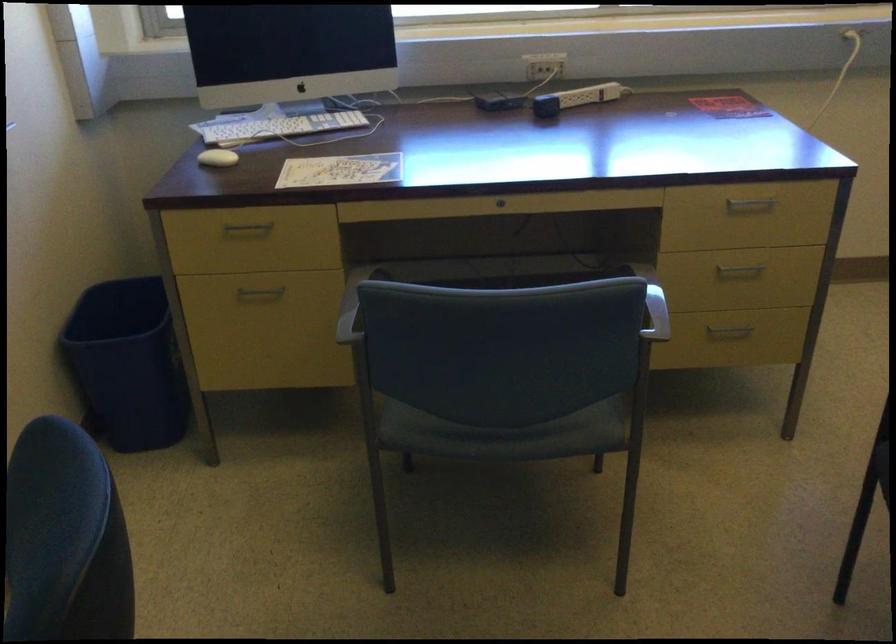
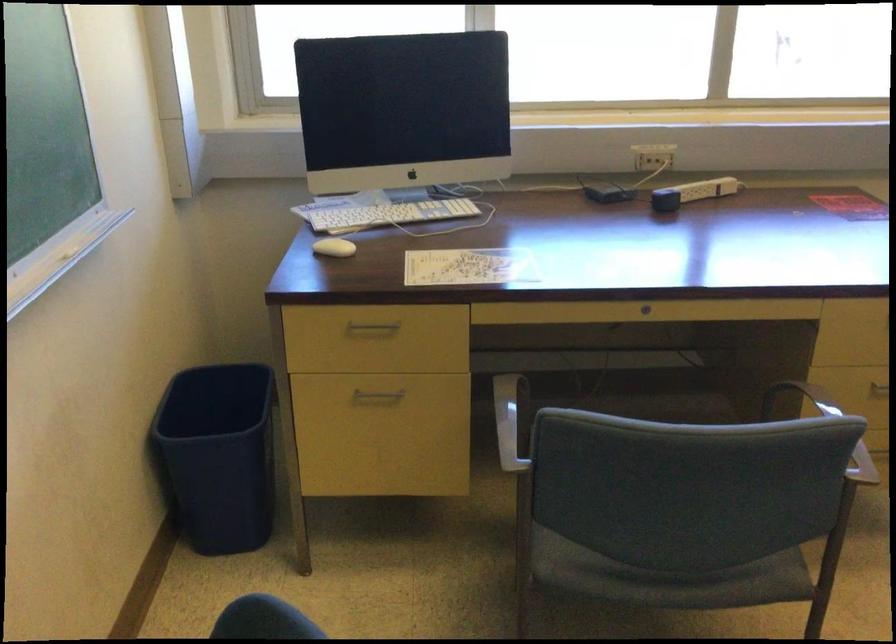
Locate, in the second image, the point that corresponds to point (612, 290) in the first image.

(825, 427)